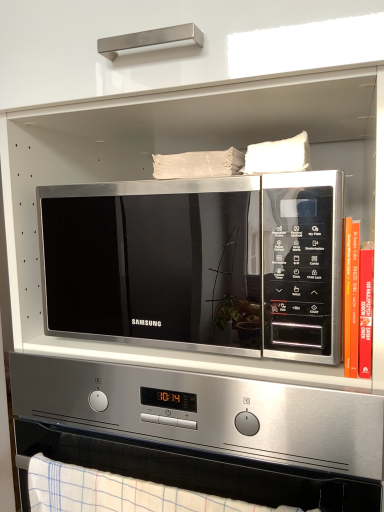
Question: Considering the positions of point (200, 293) and point (155, 502), is point (200, 293) closer or farther from the camera than point (155, 502)?

Choices:
 (A) closer
 (B) farther

Answer: (B)

Question: Is satin silver microwave at center inside the boundaries of white checkered towel at lower center, or outside?

Choices:
 (A) inside
 (B) outside

Answer: (B)

Question: Considering the real-world distances, which object is closest to the white checkered towel at lower center?

Choices:
 (A) hardcover book at right
 (B) satin silver microwave at center
 (C) satin silver microwave at center

Answer: (B)

Question: Which object is positioned closest to the hardcover book at right?

Choices:
 (A) satin silver microwave at center
 (B) satin silver microwave at center
 (C) white checkered towel at lower center

Answer: (B)